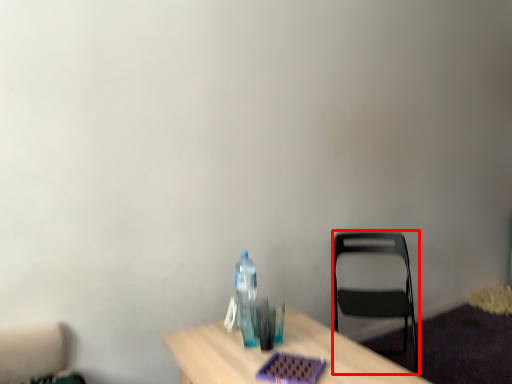
Question: From the image's perspective, what is the correct spatial relationship of chair (annotated by the red box) in relation to bottle?

Choices:
 (A) below
 (B) above

Answer: (A)